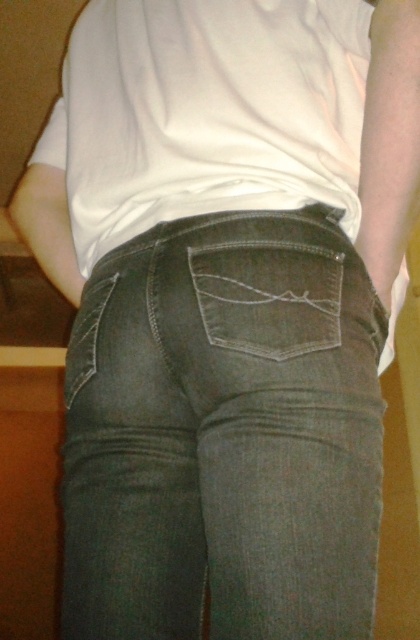
Question: Does dark gray denim jeans at center have a lesser width compared to denim pocket at center?

Choices:
 (A) yes
 (B) no

Answer: (B)

Question: Is dark gray denim jeans at center to the left of denim pocket at center from the viewer's perspective?

Choices:
 (A) no
 (B) yes

Answer: (B)

Question: Among these points, which one is farthest from the camera?

Choices:
 (A) pyautogui.click(x=346, y=573)
 (B) pyautogui.click(x=280, y=324)

Answer: (B)

Question: Is dark gray denim jeans at center positioned behind denim pocket at center?

Choices:
 (A) yes
 (B) no

Answer: (B)